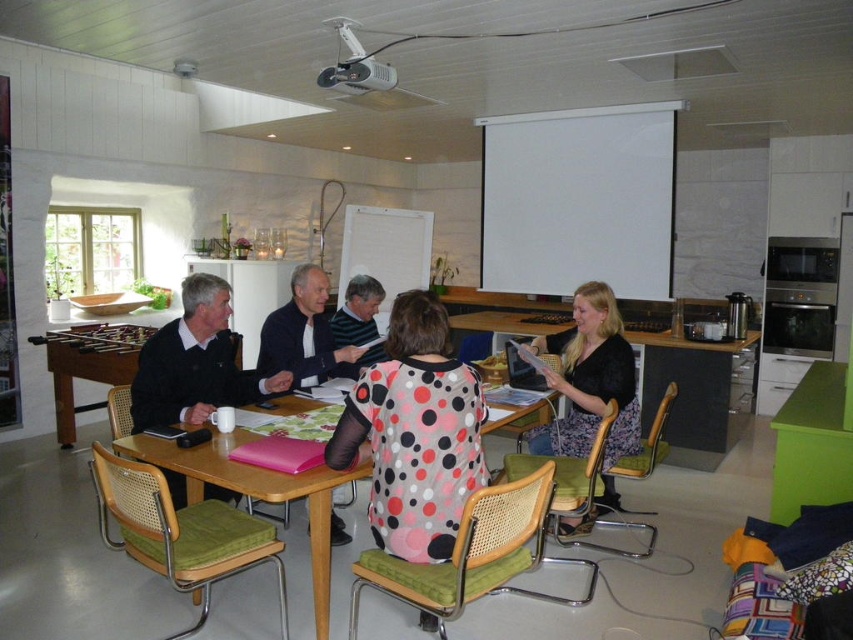
Identify the location of black sweater at center. This screenshot has height=640, width=853. (195, 364).

Which is more to the right, black sweater at center or black velvet blouse at center?

black velvet blouse at center

Which is behind, point (212, 348) or point (581, 429)?

Point (581, 429)

The height and width of the screenshot is (640, 853). I want to click on black sweater at center, so click(x=195, y=364).

Is black sweater at center below dark blue sweater at center?

Correct, black sweater at center is located below dark blue sweater at center.

Measure the distance between black sweater at center and camera.

black sweater at center is 2.82 meters from camera.

The height and width of the screenshot is (640, 853). Find the location of `black sweater at center`. black sweater at center is located at coordinates pos(195,364).

Is dark blue sweater at center in front of polka dot fabric shirt at center?

That is True.

Between dark blue sweater at center and polka dot fabric shirt at center, which one is positioned lower?

Positioned lower is dark blue sweater at center.

Does point (280, 352) lie behind point (350, 284)?

No, it is in front of (350, 284).

Identify the location of dark blue sweater at center. (305, 333).